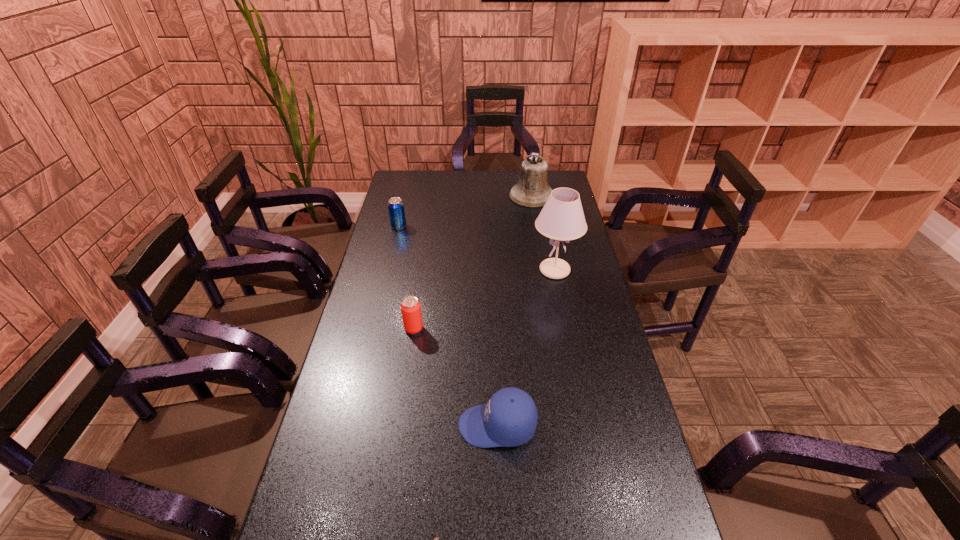
Locate an element on the screen. object that is at the far right corner is located at coordinates (532, 190).

In the image, there is a desktop. Identify the location of vacant region at the far edge. (484, 194).

Locate an element on the screen. This screenshot has height=540, width=960. free space at the left edge of the desktop is located at coordinates (387, 242).

Where is `vacant space at the right edge`? vacant space at the right edge is located at coordinates (592, 318).

Identify the location of vacant space at the far left corner of the desktop. (413, 172).

In order to click on vacant area at the far right corner of the desktop in this screenshot , I will do `click(561, 184)`.

Locate an element on the screen. free spot between the fifth farthest object and the tallest object is located at coordinates (526, 348).

At what (x,y) coordinates should I click in order to perform the action: click on free point between the fifth farthest object and the tallest object. Please return your answer as a coordinate pair (x, y). Looking at the image, I should click on (526, 348).

Locate an element on the screen. This screenshot has height=540, width=960. free space between the fifth object from right to left and the lampshade is located at coordinates (484, 300).

Image resolution: width=960 pixels, height=540 pixels. What are the coordinates of `vacant area that lies between the lampshade and the fifth farthest object` in the screenshot? It's located at (526, 348).